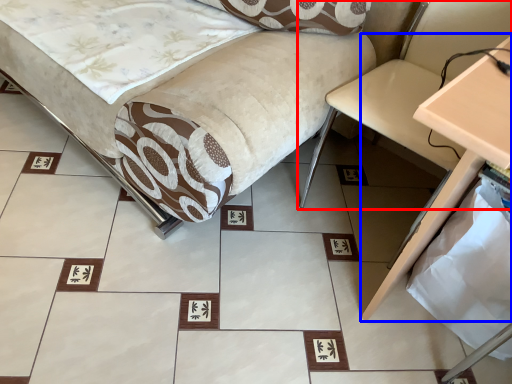
Question: Which of the following is the closest to the observer, swivel chair (highlighted by a red box) or table (highlighted by a blue box)?

Choices:
 (A) swivel chair
 (B) table

Answer: (B)